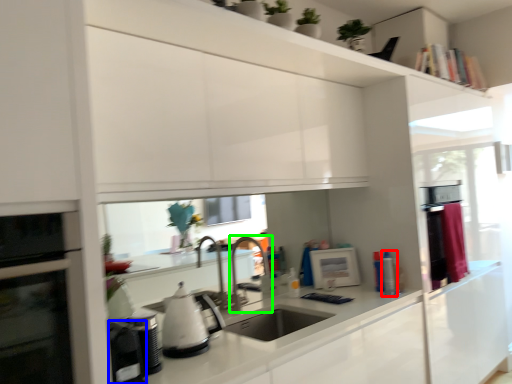
Question: Which object is the farthest from appliance (highlighted by a red box)? Choose among these: appliance (highlighted by a blue box) or faucet (highlighted by a green box).

Choices:
 (A) appliance
 (B) faucet

Answer: (A)